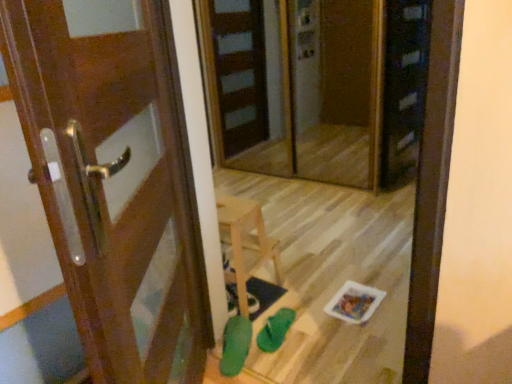
Question: Can you confirm if transparent glass screen door at center is taller than green rubber shoe at lower center, which is the second shoe in right-to-left order?

Choices:
 (A) no
 (B) yes

Answer: (B)

Question: Is transparent glass screen door at center to the left of green rubber shoe at lower center, arranged as the first shoe when viewed from the left, from the viewer's perspective?

Choices:
 (A) no
 (B) yes

Answer: (A)

Question: Can you confirm if transparent glass screen door at center is shorter than green rubber shoe at lower center, arranged as the first shoe when viewed from the left?

Choices:
 (A) no
 (B) yes

Answer: (A)

Question: Would you consider transparent glass screen door at center to be distant from green rubber shoe at lower center, which is the second shoe in right-to-left order?

Choices:
 (A) no
 (B) yes

Answer: (B)

Question: Is transparent glass screen door at center facing away from green rubber shoe at lower center, arranged as the first shoe when viewed from the left?

Choices:
 (A) no
 (B) yes

Answer: (A)

Question: Looking at the image, does green rubber shoe at lower center, which is the 1th shoe from right to left, seem bigger or smaller compared to green rubber shoe at lower center, which is the second shoe in right-to-left order?

Choices:
 (A) small
 (B) big

Answer: (A)

Question: From a real-world perspective, is green rubber shoe at lower center, the 2th shoe in the left-to-right sequence, positioned above or below green rubber shoe at lower center, which is the second shoe in right-to-left order?

Choices:
 (A) above
 (B) below

Answer: (B)

Question: Is green rubber shoe at lower center, the 2th shoe in the left-to-right sequence, wider or thinner than green rubber shoe at lower center, arranged as the first shoe when viewed from the left?

Choices:
 (A) wide
 (B) thin

Answer: (B)

Question: Relative to green rubber shoe at lower center, which is the second shoe in right-to-left order, is green rubber shoe at lower center, the 2th shoe in the left-to-right sequence, in front or behind?

Choices:
 (A) front
 (B) behind

Answer: (B)

Question: Choose the correct answer: Is transparent glass screen door at center inside green rubber shoe at lower center, arranged as the first shoe when viewed from the left, or outside it?

Choices:
 (A) inside
 (B) outside

Answer: (B)

Question: Does point (266, 97) appear closer or farther from the camera than point (239, 332)?

Choices:
 (A) closer
 (B) farther

Answer: (B)

Question: In the image, is transparent glass screen door at center positioned in front of or behind green rubber shoe at lower center, which is the second shoe in right-to-left order?

Choices:
 (A) front
 (B) behind

Answer: (B)

Question: From the image's perspective, is transparent glass screen door at center located above or below green rubber shoe at lower center, which is the second shoe in right-to-left order?

Choices:
 (A) above
 (B) below

Answer: (A)

Question: From their relative heights in the image, would you say transparent glass screen door at center is taller or shorter than green rubber shoe at lower center, the 2th shoe in the left-to-right sequence?

Choices:
 (A) short
 (B) tall

Answer: (B)

Question: Would you say transparent glass screen door at center is to the left or to the right of green rubber shoe at lower center, which is the 1th shoe from right to left, in the picture?

Choices:
 (A) right
 (B) left

Answer: (A)